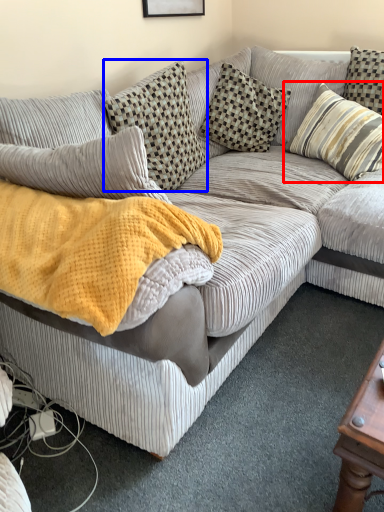
Question: Which of the following is the farthest to the observer, pillow (highlighted by a red box) or pillow (highlighted by a blue box)?

Choices:
 (A) pillow
 (B) pillow

Answer: (A)